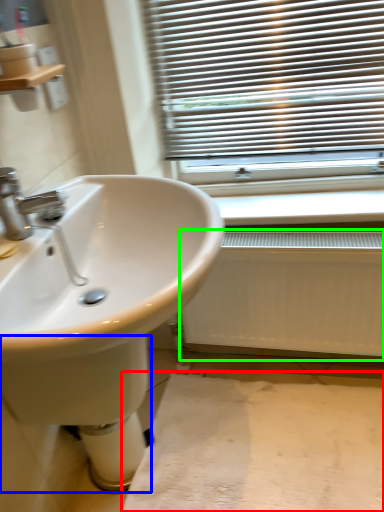
Question: Estimate the real-world distances between objects in this image. Which object is closer to plain (highlighted by a red box), bidet (highlighted by a blue box) or radiator (highlighted by a green box)?

Choices:
 (A) bidet
 (B) radiator

Answer: (B)